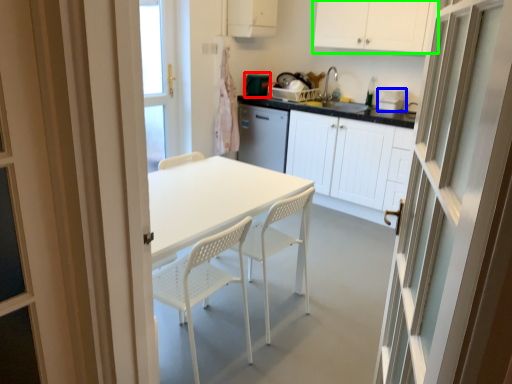
Question: Considering the real-world distances, which object is closest to appliance (highlighted by a red box)? appliance (highlighted by a blue box) or cabinetry (highlighted by a green box).

Choices:
 (A) appliance
 (B) cabinetry

Answer: (B)